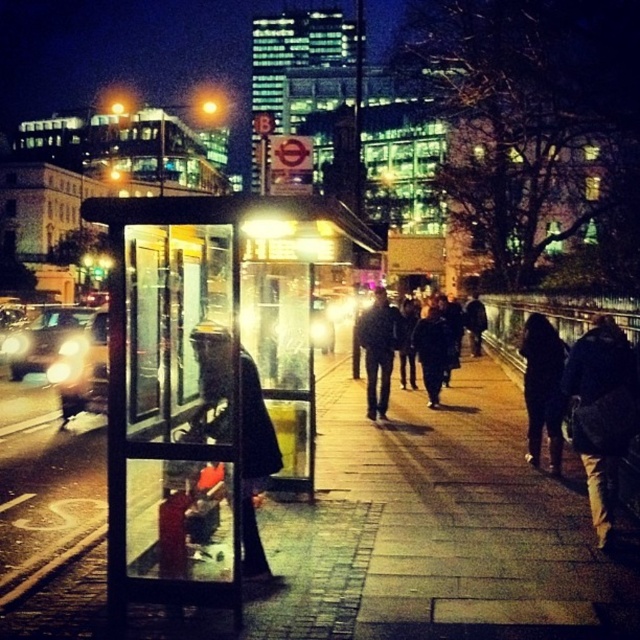
You are a photographer standing at the sidewalk and see the brown leather jacket at right and the black leather jacket at center. Which jacket is higher in the image?

The brown leather jacket at right is above the black leather jacket at center in the image.